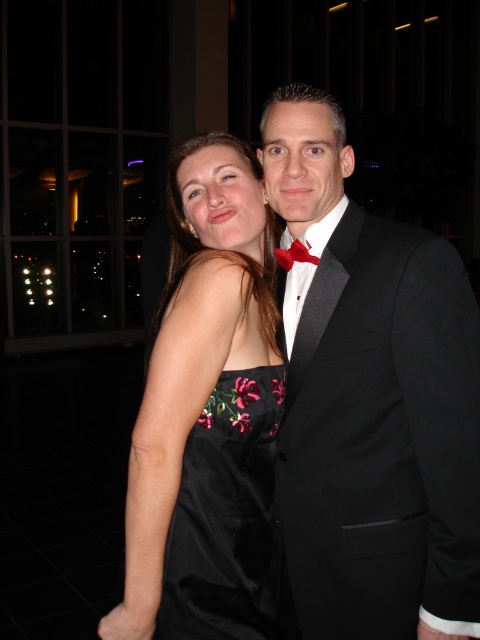
Between point (216, 326) and point (206, 513), which one is positioned in front?

Positioned in front is point (216, 326).

Where is `satin black dress at center`? satin black dress at center is located at coordinates (206, 413).

Is point (237, 177) behind point (217, 586)?

Yes, point (237, 177) is farther from viewer.

Where is `satin black dress at center`? The height and width of the screenshot is (640, 480). satin black dress at center is located at coordinates (206, 413).

Does black satin tuxedo at center have a larger size compared to matte black bow tie at center?

Yes, black satin tuxedo at center is bigger than matte black bow tie at center.

Which is in front, point (351, 589) or point (308, 243)?

Point (351, 589) is more forward.

The image size is (480, 640). What do you see at coordinates (371, 401) in the screenshot?
I see `black satin tuxedo at center` at bounding box center [371, 401].

I want to click on black satin tuxedo at center, so click(x=371, y=401).

Does satin black dress at center have a lesser height compared to matte black bow tie at center?

Incorrect, satin black dress at center's height does not fall short of matte black bow tie at center's.

Does satin black dress at center have a greater height compared to matte black bow tie at center?

Indeed, satin black dress at center has a greater height compared to matte black bow tie at center.

At what (x,y) coordinates should I click in order to perform the action: click on satin black dress at center. Please return your answer as a coordinate pair (x, y). This screenshot has width=480, height=640. Looking at the image, I should click on (206, 413).